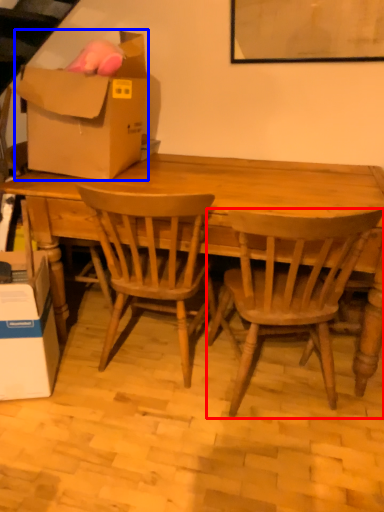
Question: Which of the following is the closest to the observer, chair (highlighted by a red box) or box (highlighted by a blue box)?

Choices:
 (A) chair
 (B) box

Answer: (A)